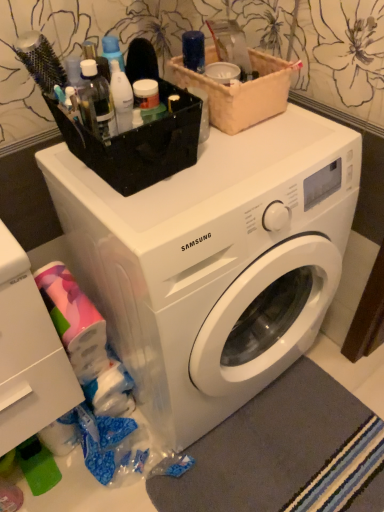
Where is `vacant area on top of gray soft rug at lower right (from a real-world perspective)`? The width and height of the screenshot is (384, 512). vacant area on top of gray soft rug at lower right (from a real-world perspective) is located at coordinates (288, 458).